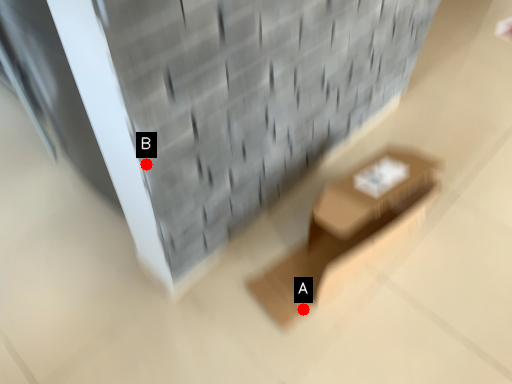
Question: Two points are circled on the image, labeled by A and B beside each circle. Which point is closer to the camera?

Choices:
 (A) A is closer
 (B) B is closer

Answer: (B)